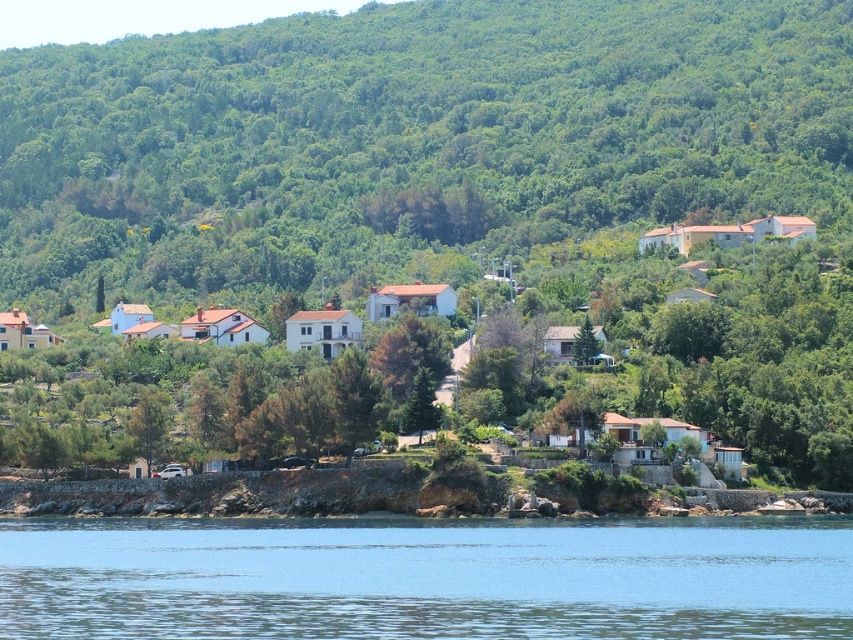
Who is taller, green leafy tree at center or transparent blue water at lower center?

Standing taller between the two is green leafy tree at center.

Is green leafy tree at center further to camera compared to transparent blue water at lower center?

Yes, green leafy tree at center is behind transparent blue water at lower center.

Is point (712, 28) farther from camera compared to point (581, 556)?

That is True.

You are a GUI agent. You are given a task and a screenshot of the screen. Output one action in this format:
    pyautogui.click(x=<x>, y=<y>)
    Task: Click on the green leafy tree at center
    The width and height of the screenshot is (853, 640).
    Given the screenshot: What is the action you would take?
    pyautogui.click(x=407, y=140)